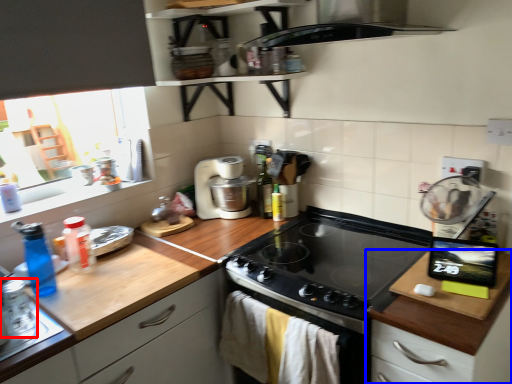
Question: Which of the following is the closest to the observer, appliance (highlighted by a red box) or cabinetry (highlighted by a blue box)?

Choices:
 (A) appliance
 (B) cabinetry

Answer: (B)